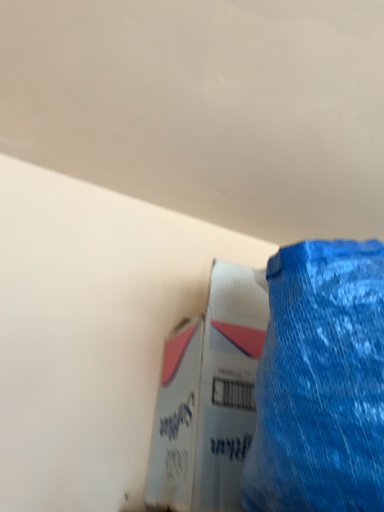
Identify the location of blue textured box at lower right. The width and height of the screenshot is (384, 512). (209, 396).

Based on the photo, what is the approximate width of blue textured box at lower right?

blue textured box at lower right is 22.91 centimeters wide.

What do you see at coordinates (209, 396) in the screenshot? I see `blue textured box at lower right` at bounding box center [209, 396].

You are a GUI agent. You are given a task and a screenshot of the screen. Output one action in this format:
    pyautogui.click(x=<x>, y=<y>)
    Task: Click on the blue textured box at lower right
    This screenshot has height=512, width=384.
    Given the screenshot: What is the action you would take?
    pyautogui.click(x=209, y=396)